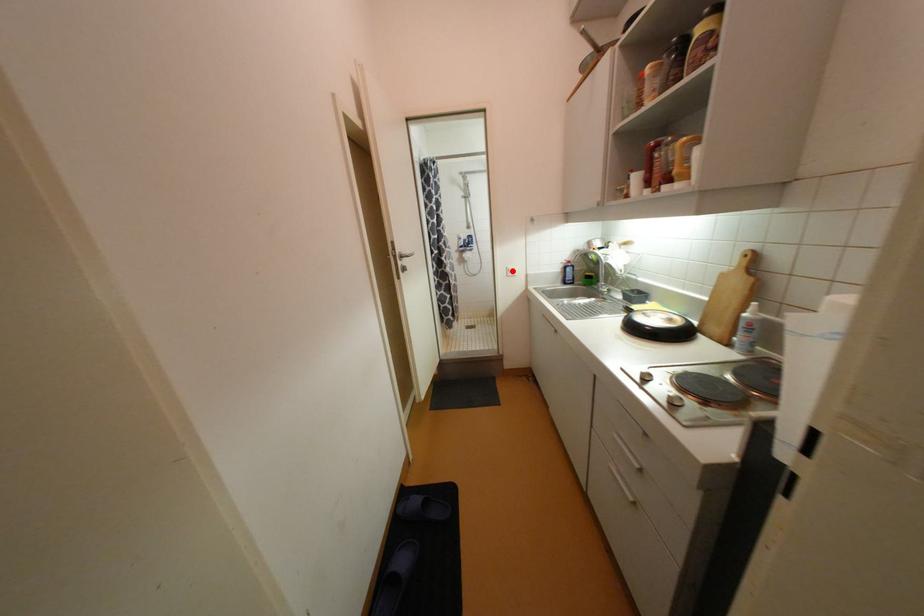
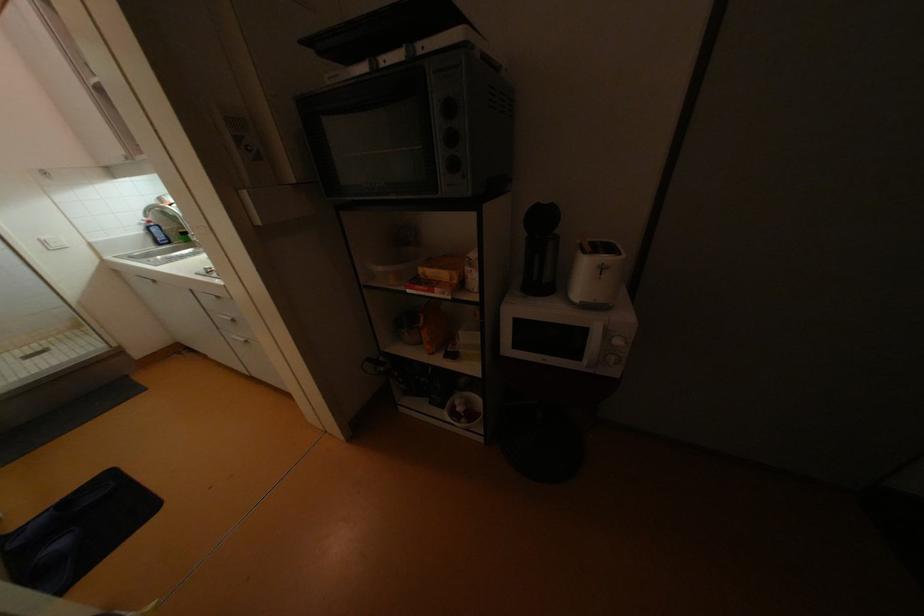
In the second image, find the point that corresponds to the highlighted location in the first image.

(49, 243)